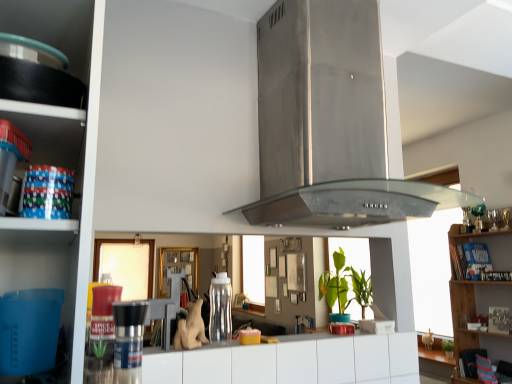
You are a GUI agent. You are given a task and a screenshot of the screen. Output one action in this format:
    pyautogui.click(x=<x>, y=<y>)
    Task: Click on the matte black pan at left, arranged as the first shelf when viewed from the front
    
    Given the screenshot: What is the action you would take?
    pyautogui.click(x=54, y=27)

Describe the element at coordinates (474, 315) in the screenshot. I see `wooden bookshelf at right, arranged as the 3th shelf when viewed from the front` at that location.

Measure the distance between point (490, 233) and camera.

They are 10.56 feet apart.

This screenshot has width=512, height=384. What do you see at coordinates (50, 138) in the screenshot? I see `blue plastic bowls at left, which appears as the 2th shelf when viewed from the right` at bounding box center [50, 138].

Locate an element on the screen. The width and height of the screenshot is (512, 384). white matte drawer at center is located at coordinates (292, 362).

Image resolution: width=512 pixels, height=384 pixels. Identify the location of stainless steel exhaust hood at upper center. (329, 122).

Can you tell me how much matte black pan at left, arranged as the 3th shelf when viewed from the right, and blue plastic bowls at left, placed as the 2th shelf when sorted from front to back, differ in facing direction?

matte black pan at left, arranged as the 3th shelf when viewed from the right, and blue plastic bowls at left, placed as the 2th shelf when sorted from front to back, are facing 4.33 degrees away from each other.

Is matte black pan at left, which ranks as the 1th shelf in top-to-bottom order, next to blue plastic bowls at left, arranged as the second shelf when viewed from the left?

matte black pan at left, which ranks as the 1th shelf in top-to-bottom order, and blue plastic bowls at left, arranged as the second shelf when viewed from the left, are clearly separated.

Is matte black pan at left, arranged as the 3th shelf when viewed from the right, oriented away from blue plastic bowls at left, placed as the 2th shelf when sorted from back to front?

No.

Can you confirm if matte black pan at left, the third shelf ordered from the bottom, is taller than blue plastic bowls at left, placed as the 2th shelf when sorted from front to back?

No, matte black pan at left, the third shelf ordered from the bottom, is not taller than blue plastic bowls at left, placed as the 2th shelf when sorted from front to back.

Considering the relative sizes of wooden bookshelf at right, the 1th shelf viewed from the back, and clear plastic water bottle at center, placed as the 2th appliance when sorted from left to right, in the image provided, is wooden bookshelf at right, the 1th shelf viewed from the back, wider than clear plastic water bottle at center, placed as the 2th appliance when sorted from left to right,?

Indeed, wooden bookshelf at right, the 1th shelf viewed from the back, has a greater width compared to clear plastic water bottle at center, placed as the 2th appliance when sorted from left to right.

Does wooden bookshelf at right, which is the third shelf in left-to-right order, turn towards clear plastic water bottle at center, placed as the 2th appliance when sorted from left to right?

Yes, wooden bookshelf at right, which is the third shelf in left-to-right order, is oriented towards clear plastic water bottle at center, placed as the 2th appliance when sorted from left to right.

Does point (466, 290) appear closer or farther from the camera than point (212, 326)?

Point (466, 290).

From a real-world perspective, does wooden bookshelf at right, the 1th shelf viewed from the back, stand above clear plastic water bottle at center, placed as the 2th appliance when sorted from left to right?

No.

Is wooden bookshelf at right, arranged as the 3th shelf when viewed from the front, surrounding blue plastic bowls at left, positioned as the 2th shelf in top-to-bottom order?

No, blue plastic bowls at left, positioned as the 2th shelf in top-to-bottom order, is not a part of wooden bookshelf at right, arranged as the 3th shelf when viewed from the front.

Who is smaller, wooden bookshelf at right, acting as the 1th shelf starting from the right, or blue plastic bowls at left, acting as the 2th shelf starting from the bottom?

blue plastic bowls at left, acting as the 2th shelf starting from the bottom, is smaller.

Considering the sizes of objects wooden bookshelf at right, arranged as the 3th shelf when viewed from the front, and blue plastic bowls at left, arranged as the second shelf when viewed from the left, in the image provided, who is thinner, wooden bookshelf at right, arranged as the 3th shelf when viewed from the front, or blue plastic bowls at left, arranged as the second shelf when viewed from the left,?

blue plastic bowls at left, arranged as the second shelf when viewed from the left.

Which point is more distant from viewer, (x=465, y=303) or (x=57, y=130)?

Positioned behind is point (x=465, y=303).

What's the angular difference between matte black pan at left, the third shelf ordered from the bottom, and stainless steel exhaust hood at upper center's facing directions?

matte black pan at left, the third shelf ordered from the bottom, and stainless steel exhaust hood at upper center are facing 4.59 degrees away from each other.

Which of these two, matte black pan at left, arranged as the 3th shelf when viewed from the right, or stainless steel exhaust hood at upper center, stands taller?

Standing taller between the two is stainless steel exhaust hood at upper center.

From a real-world perspective, is matte black pan at left, the 3th shelf from the back, located higher than stainless steel exhaust hood at upper center?

No, from a real-world perspective, matte black pan at left, the 3th shelf from the back, is not above stainless steel exhaust hood at upper center.

Can you confirm if blue plastic bowls at left, arranged as the second shelf when viewed from the left, is thinner than stainless steel exhaust hood at upper center?

Yes.

How much distance is there between blue plastic bowls at left, placed as the 2th shelf when sorted from back to front, and stainless steel exhaust hood at upper center?

The distance of blue plastic bowls at left, placed as the 2th shelf when sorted from back to front, from stainless steel exhaust hood at upper center is 69.18 centimeters.

Is point (71, 134) positioned after point (269, 175)?

No, it is not.

Based on the photo, from a real-world perspective, which is physically above, blue plastic bowls at left, positioned as the 2th shelf in top-to-bottom order, or stainless steel exhaust hood at upper center?

In real-world perspective, stainless steel exhaust hood at upper center is above.

Locate an element on the screen. drawer below the wooden bookshelf at right, acting as the 1th shelf starting from the right (from a real-world perspective) is located at coordinates (292, 362).

Is white matte drawer at center to the right of wooden bookshelf at right, acting as the 1th shelf starting from the right, from the viewer's perspective?

In fact, white matte drawer at center is to the left of wooden bookshelf at right, acting as the 1th shelf starting from the right.

Is point (403, 368) closer or farther from the camera than point (494, 244)?

Point (403, 368) is closer to the camera than point (494, 244).

Considering the positions of objects white matte drawer at center and wooden bookshelf at right, which is the third shelf in left-to-right order, in the image provided, who is behind, white matte drawer at center or wooden bookshelf at right, which is the third shelf in left-to-right order,?

wooden bookshelf at right, which is the third shelf in left-to-right order, is further from the camera.

Is matte black pan at left, arranged as the first shelf when viewed from the front, smaller than wooden bookshelf at right, acting as the 1th shelf starting from the right?

Yes.

Based on the photo, between matte black pan at left, the first shelf positioned from the left, and wooden bookshelf at right, which is the third shelf in left-to-right order, which one appears on the left side from the viewer's perspective?

matte black pan at left, the first shelf positioned from the left, is more to the left.

Is the surface of matte black pan at left, the first shelf positioned from the left, in direct contact with wooden bookshelf at right, which is the third shelf in left-to-right order?

No, matte black pan at left, the first shelf positioned from the left, is not with wooden bookshelf at right, which is the third shelf in left-to-right order.

Locate an element on the screen. shelf that is the 1st one when counting rightward from the matte black pan at left, the third shelf ordered from the bottom is located at coordinates pos(50,138).

Identify the location of shelf lying behind the clear plastic water bottle at center, acting as the 2th appliance starting from the front. The image size is (512, 384). point(474,315).

Which object lies nearer to the anchor point clear plastic water bottle at center, the 1th appliance from the back, stainless steel exhaust hood at upper center or matte black pan at left, the first shelf positioned from the left?

Based on the image, stainless steel exhaust hood at upper center appears to be nearer to clear plastic water bottle at center, the 1th appliance from the back.

Estimate the real-world distances between objects in this image. Which object is closer to stainless steel exhaust hood at upper center, white matte drawer at center or blue plastic bowls at left, arranged as the second shelf when viewed from the left?

white matte drawer at center.

From the image, which object appears to be nearer to blue plastic bowls at left, acting as the 2th shelf starting from the bottom, wooden bookshelf at right, acting as the 1th shelf starting from the right, or clear plastic water bottle at center, acting as the 2th appliance starting from the front?

clear plastic water bottle at center, acting as the 2th appliance starting from the front, is positioned closer to the anchor blue plastic bowls at left, acting as the 2th shelf starting from the bottom.

From the image, which object appears to be farther from wooden bookshelf at right, arranged as the 3th shelf when viewed from the front, stainless steel exhaust hood at upper center or brushed metal pepper grinder at center, acting as the first appliance starting from the front?

Based on the image, brushed metal pepper grinder at center, acting as the first appliance starting from the front, appears to be further to wooden bookshelf at right, arranged as the 3th shelf when viewed from the front.

Which object lies nearer to the anchor point white matte drawer at center, brushed metal pepper grinder at center, acting as the first appliance starting from the front, or stainless steel exhaust hood at upper center?

Among the two, stainless steel exhaust hood at upper center is located nearer to white matte drawer at center.

When comparing their distances from stainless steel exhaust hood at upper center, does matte black pan at left, which ranks as the 1th shelf in top-to-bottom order, or wooden bookshelf at right, the 1th shelf viewed from the back, seem further?

wooden bookshelf at right, the 1th shelf viewed from the back, lies further to stainless steel exhaust hood at upper center than the other object.

Estimate the real-world distances between objects in this image. Which object is further from matte black pan at left, arranged as the 3th shelf when viewed from the right, wooden bookshelf at right, which is the third shelf in left-to-right order, or brushed metal pepper grinder at center, the first appliance positioned from the left?

Based on the image, wooden bookshelf at right, which is the third shelf in left-to-right order, appears to be further to matte black pan at left, arranged as the 3th shelf when viewed from the right.

Based on their spatial positions, is wooden bookshelf at right, arranged as the 3th shelf when viewed from the front, or clear plastic water bottle at center, arranged as the 1th appliance when viewed from the right, further from stainless steel exhaust hood at upper center?

The object further to stainless steel exhaust hood at upper center is wooden bookshelf at right, arranged as the 3th shelf when viewed from the front.

Locate an element on the screen. Image resolution: width=512 pixels, height=384 pixels. drawer between blue plastic bowls at left, which appears as the 2th shelf when viewed from the right, and wooden bookshelf at right, acting as the 1th shelf starting from the right is located at coordinates (292, 362).

Image resolution: width=512 pixels, height=384 pixels. In order to click on drawer between stainless steel exhaust hood at upper center and wooden bookshelf at right, which is the third shelf in left-to-right order, in the front-back direction in this screenshot , I will do `click(292, 362)`.

Identify the location of shelf that lies between matte black pan at left, which ranks as the 1th shelf in top-to-bottom order, and white matte drawer at center from top to bottom. Image resolution: width=512 pixels, height=384 pixels. (50, 138).

Where is `drawer located between brushed metal pepper grinder at center, which is the second appliance in right-to-left order, and clear plastic water bottle at center, placed as the 2th appliance when sorted from left to right, in the depth direction`? drawer located between brushed metal pepper grinder at center, which is the second appliance in right-to-left order, and clear plastic water bottle at center, placed as the 2th appliance when sorted from left to right, in the depth direction is located at coordinates (292, 362).